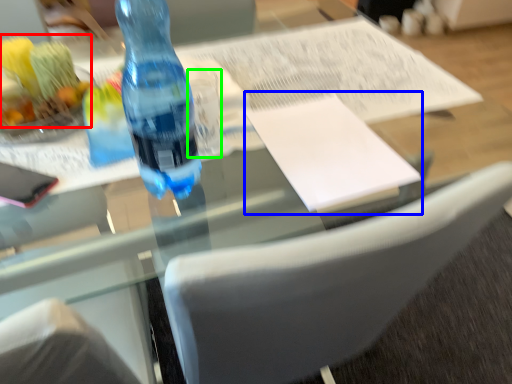
Question: Which object is the closest to the food (highlighted by a red box)? Choose among these: journal (highlighted by a blue box) or clear (highlighted by a green box).

Choices:
 (A) journal
 (B) clear

Answer: (B)